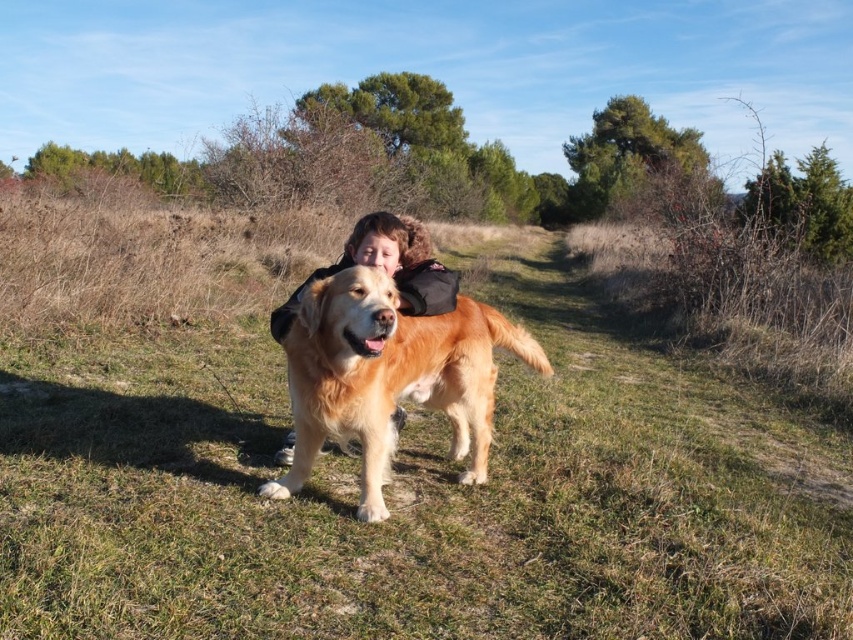
Between golden fur dog at center and golden hair at center, which one appears on the right side from the viewer's perspective?

Positioned to the right is golden fur dog at center.

Based on the photo, can you confirm if golden fur dog at center is positioned below golden hair at center?

Incorrect, golden fur dog at center is not positioned below golden hair at center.

In order to click on golden fur dog at center in this screenshot , I will do `click(389, 376)`.

What are the coordinates of `golden fur dog at center` in the screenshot? It's located at (389, 376).

Who is positioned more to the right, green grassy at center or golden hair at center?

Positioned to the right is green grassy at center.

From the picture: Does green grassy at center lie in front of golden hair at center?

Yes, it is.

Which is behind, point (509, 376) or point (422, 227)?

The point (509, 376) is behind.

In order to click on green grassy at center in this screenshot , I will do `click(415, 493)`.

Who is shorter, green grassy at center or golden fur dog at center?

golden fur dog at center

Where is `green grassy at center`? The width and height of the screenshot is (853, 640). green grassy at center is located at coordinates (415, 493).